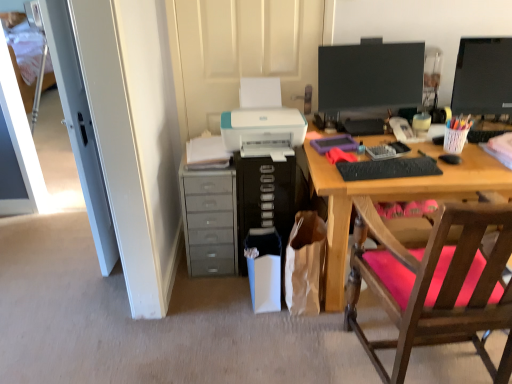
You are a GUI agent. You are given a task and a screenshot of the screen. Output one action in this format:
    pyautogui.click(x=<x>, y=<y>)
    Task: Click on the vacant area that is in front of white plastic trash can at center, the 3th stationery positioned from the top
    The width and height of the screenshot is (512, 384).
    Given the screenshot: What is the action you would take?
    pyautogui.click(x=258, y=334)